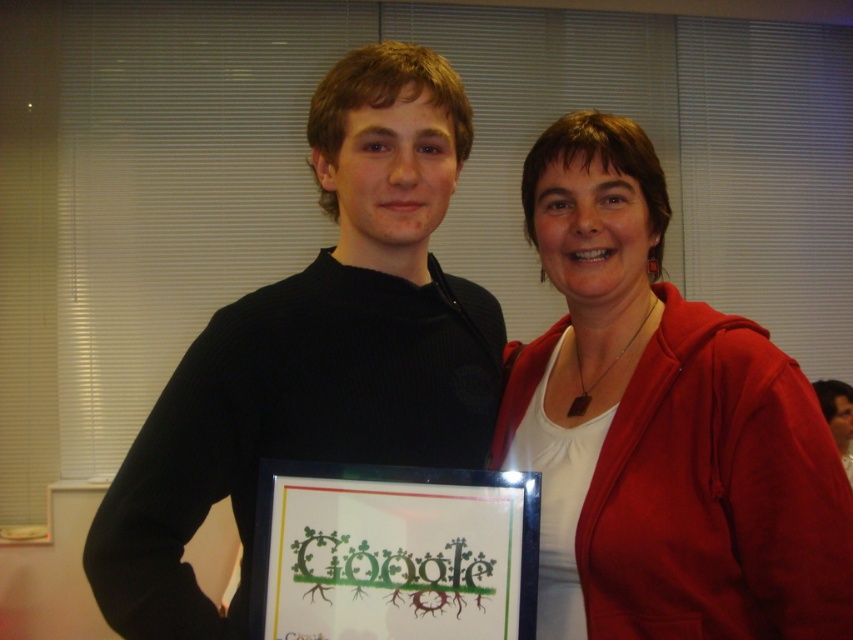
Question: Which point is farther to the camera?

Choices:
 (A) white matte shirt at center
 (B) black framed picture at center
 (C) black ribbed sweater at center

Answer: (C)

Question: Can you confirm if black ribbed sweater at center is positioned above black framed picture at center?

Choices:
 (A) yes
 (B) no

Answer: (A)

Question: Which is farther from the white matte shirt at center?

Choices:
 (A) black framed picture at center
 (B) black ribbed sweater at center

Answer: (A)

Question: Estimate the real-world distances between objects in this image. Which object is closer to the white matte shirt at center?

Choices:
 (A) black ribbed sweater at center
 (B) black framed picture at center

Answer: (A)

Question: In this image, where is white matte shirt at center located relative to black framed picture at center?

Choices:
 (A) left
 (B) right

Answer: (B)

Question: Does white matte shirt at center have a larger size compared to black framed picture at center?

Choices:
 (A) no
 (B) yes

Answer: (B)